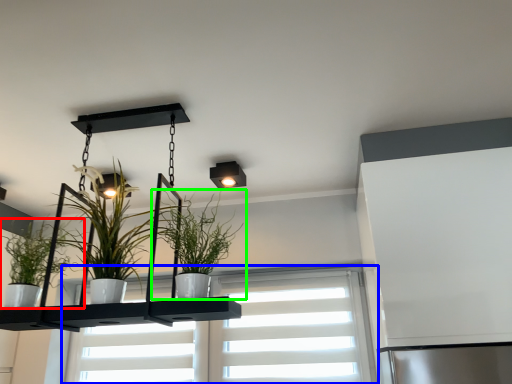
Question: Which object is the farthest from houseplant (highlighted by a red box)? Choose among these: window (highlighted by a blue box) or houseplant (highlighted by a green box).

Choices:
 (A) window
 (B) houseplant

Answer: (A)